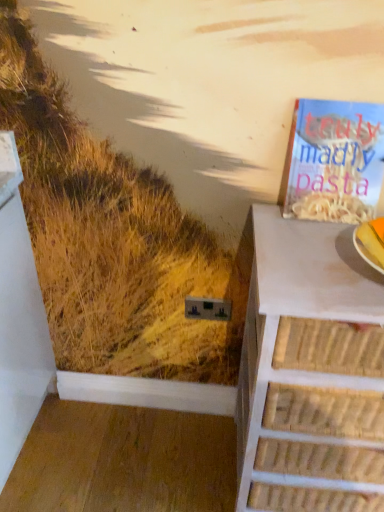
Locate an element on the screen. The height and width of the screenshot is (512, 384). vacant area situated to the left side of matte paper book at upper right is located at coordinates pyautogui.click(x=273, y=220).